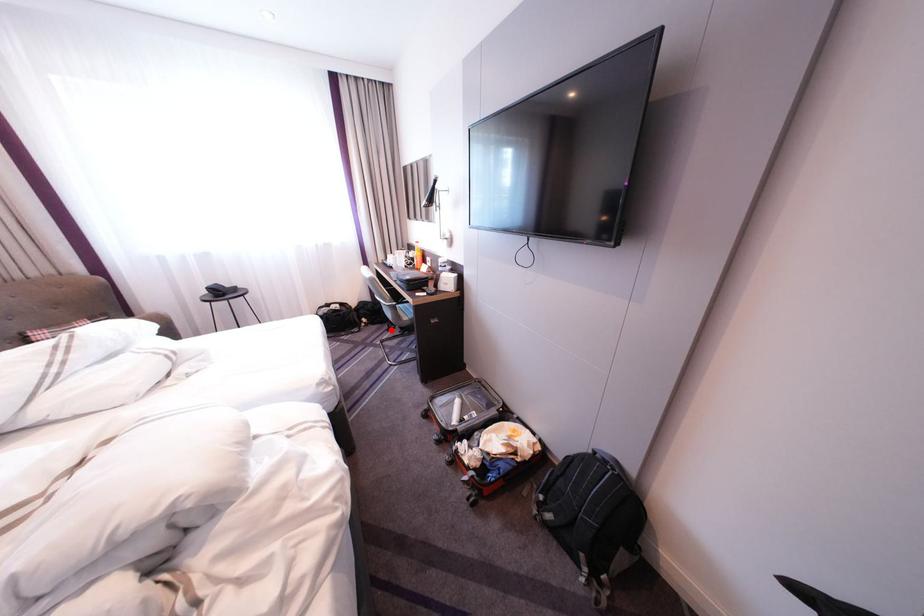
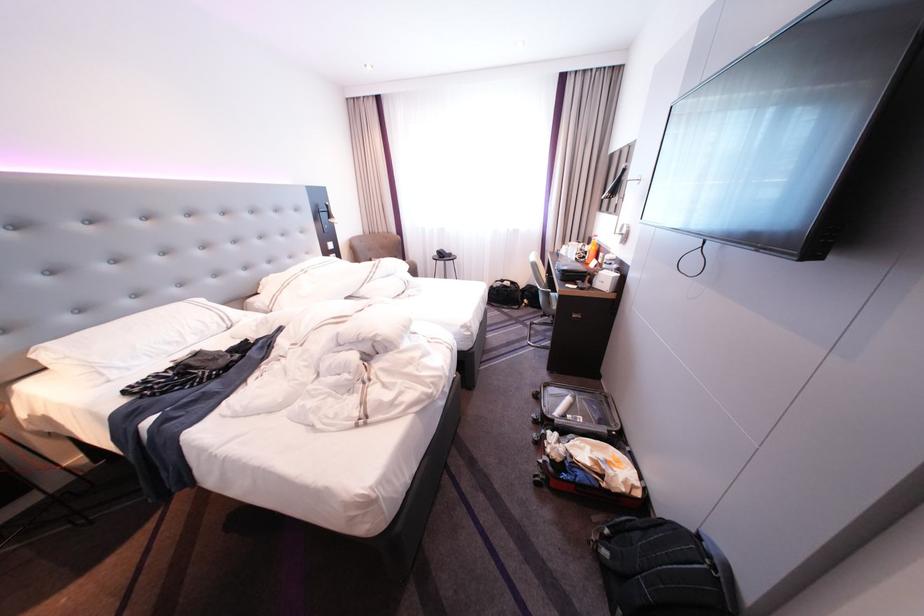
Question: I am providing you with two images of the same scene from different viewpoints. A red point is marked on the first image. Is the red point's position out of view in image 2?

Choices:
 (A) Yes
 (B) No

Answer: (B)